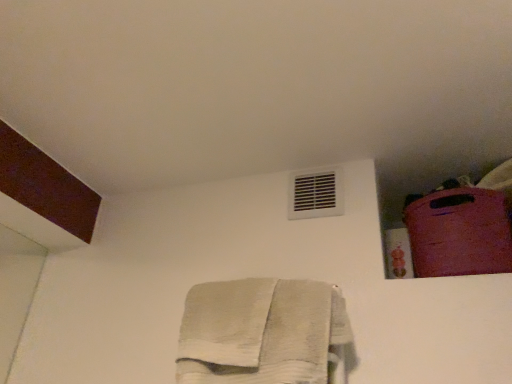
This screenshot has width=512, height=384. Find the location of `rubberized pink suitcase at upper right`. rubberized pink suitcase at upper right is located at coordinates (459, 232).

Find the location of a particular element. white cotton towel at center is located at coordinates pyautogui.click(x=261, y=332).

You are a GUI agent. You are given a task and a screenshot of the screen. Output one action in this format:
    pyautogui.click(x=<x>, y=<y>)
    Task: Click on the rubberized pink suitcase at upper right
    
    Given the screenshot: What is the action you would take?
    pyautogui.click(x=459, y=232)

From the image's perspective, is white plastic air conditioning at upper center positioned above or below rubberized pink suitcase at upper right?

white plastic air conditioning at upper center is above rubberized pink suitcase at upper right.

Is white plastic air conditioning at upper center positioned far away from rubberized pink suitcase at upper right?

No.

Is white plastic air conditioning at upper center turned away from rubberized pink suitcase at upper right?

No, white plastic air conditioning at upper center's orientation is not away from rubberized pink suitcase at upper right.

How different are the orientations of white plastic air conditioning at upper center and rubberized pink suitcase at upper right in degrees?

3.38 degrees separate the facing orientations of white plastic air conditioning at upper center and rubberized pink suitcase at upper right.

Does white cotton towel at center have a larger size compared to white plastic air conditioning at upper center?

Correct, white cotton towel at center is larger in size than white plastic air conditioning at upper center.

Would you say white cotton towel at center contains white plastic air conditioning at upper center?

No, white cotton towel at center does not contain white plastic air conditioning at upper center.

From a real-world perspective, is white cotton towel at center physically located above or below white plastic air conditioning at upper center?

From a real-world perspective, white cotton towel at center is physically below white plastic air conditioning at upper center.

How much distance is there between white cotton towel at center and white plastic air conditioning at upper center?

They are 15.96 inches apart.

From the image's perspective, relative to white plastic air conditioning at upper center, is rubberized pink suitcase at upper right above or below?

rubberized pink suitcase at upper right is below white plastic air conditioning at upper center.

Does rubberized pink suitcase at upper right turn towards white plastic air conditioning at upper center?

No, rubberized pink suitcase at upper right is not facing towards white plastic air conditioning at upper center.

Is rubberized pink suitcase at upper right completely or partially outside of white plastic air conditioning at upper center?

rubberized pink suitcase at upper right is positioned outside white plastic air conditioning at upper center.

Is white plastic air conditioning at upper center aimed at white cotton towel at center?

No, white plastic air conditioning at upper center is not facing towards white cotton towel at center.

From the image's perspective, is white plastic air conditioning at upper center located above white cotton towel at center?

Correct, white plastic air conditioning at upper center appears higher than white cotton towel at center in the image.

Considering the positions of objects white plastic air conditioning at upper center and white cotton towel at center in the image provided, who is more to the left, white plastic air conditioning at upper center or white cotton towel at center?

white cotton towel at center is more to the left.

Can you confirm if white plastic air conditioning at upper center is thinner than white cotton towel at center?

Yes, white plastic air conditioning at upper center is thinner than white cotton towel at center.

Is white cotton towel at center at the back of rubberized pink suitcase at upper right?

No, rubberized pink suitcase at upper right is not facing away from white cotton towel at center.

What's the angular difference between rubberized pink suitcase at upper right and white cotton towel at center's facing directions?

3.79 degrees.

Is rubberized pink suitcase at upper right bigger than white cotton towel at center?

No.

How many degrees apart are the facing directions of white cotton towel at center and rubberized pink suitcase at upper right?

3.79 degrees separate the facing orientations of white cotton towel at center and rubberized pink suitcase at upper right.

How much distance is there between white cotton towel at center and rubberized pink suitcase at upper right?

white cotton towel at center is 16.91 inches from rubberized pink suitcase at upper right.

From a real-world perspective, is white cotton towel at center positioned above or below rubberized pink suitcase at upper right?

Clearly, from a real-world perspective, white cotton towel at center is below rubberized pink suitcase at upper right.

In terms of size, does white cotton towel at center appear bigger or smaller than rubberized pink suitcase at upper right?

Clearly, white cotton towel at center is larger in size than rubberized pink suitcase at upper right.

The height and width of the screenshot is (384, 512). Identify the location of air conditioning on the left side of rubberized pink suitcase at upper right. (315, 194).

Locate an element on the screen. This screenshot has width=512, height=384. towel below the white plastic air conditioning at upper center (from the image's perspective) is located at coordinates (261, 332).

Looking at this image, based on their spatial positions, is white plastic air conditioning at upper center or white cotton towel at center further from rubberized pink suitcase at upper right?

white cotton towel at center.

When comparing their distances from white plastic air conditioning at upper center, does white cotton towel at center or rubberized pink suitcase at upper right seem closer?

The object closer to white plastic air conditioning at upper center is rubberized pink suitcase at upper right.

Estimate the real-world distances between objects in this image. Which object is closer to white cotton towel at center, rubberized pink suitcase at upper right or white plastic air conditioning at upper center?

white plastic air conditioning at upper center is positioned closer to the anchor white cotton towel at center.

From the image, which object appears to be nearer to white cotton towel at center, white plastic air conditioning at upper center or rubberized pink suitcase at upper right?

white plastic air conditioning at upper center is closer to white cotton towel at center.

Which object lies nearer to the anchor point rubberized pink suitcase at upper right, white cotton towel at center or white plastic air conditioning at upper center?

The object closer to rubberized pink suitcase at upper right is white plastic air conditioning at upper center.

Based on their spatial positions, is rubberized pink suitcase at upper right or white cotton towel at center further from white plastic air conditioning at upper center?

Among the two, white cotton towel at center is located further to white plastic air conditioning at upper center.

At what (x,y) coordinates should I click in order to perform the action: click on air conditioning located between white cotton towel at center and rubberized pink suitcase at upper right in the left-right direction. Please return your answer as a coordinate pair (x, y). Looking at the image, I should click on (315, 194).